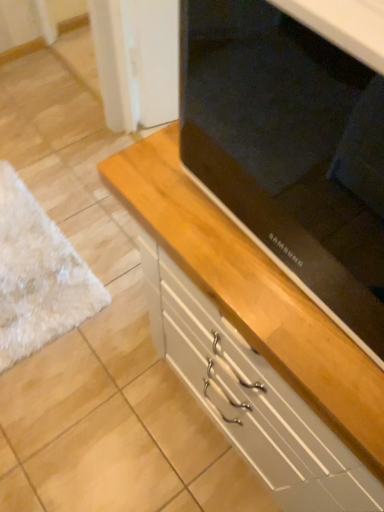
Question: Is point (188, 269) closer or farther from the camera than point (349, 261)?

Choices:
 (A) farther
 (B) closer

Answer: (B)

Question: Based on their positions, is wooden cabinet at center located to the left or right of matte black tv at center?

Choices:
 (A) left
 (B) right

Answer: (A)

Question: Is wooden cabinet at center wider or thinner than matte black tv at center?

Choices:
 (A) thin
 (B) wide

Answer: (B)

Question: From a real-world perspective, is matte black tv at center positioned above or below wooden cabinet at center?

Choices:
 (A) below
 (B) above

Answer: (B)

Question: Is point (291, 198) closer or farther from the camera than point (342, 364)?

Choices:
 (A) closer
 (B) farther

Answer: (B)

Question: Is matte black tv at center situated inside wooden cabinet at center or outside?

Choices:
 (A) outside
 (B) inside

Answer: (A)

Question: In terms of size, does matte black tv at center appear bigger or smaller than wooden cabinet at center?

Choices:
 (A) big
 (B) small

Answer: (B)